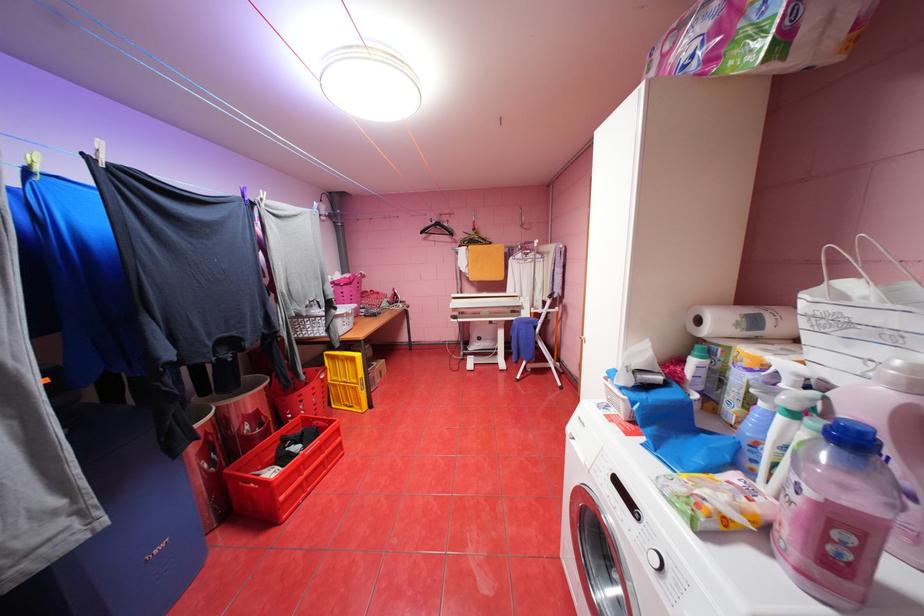
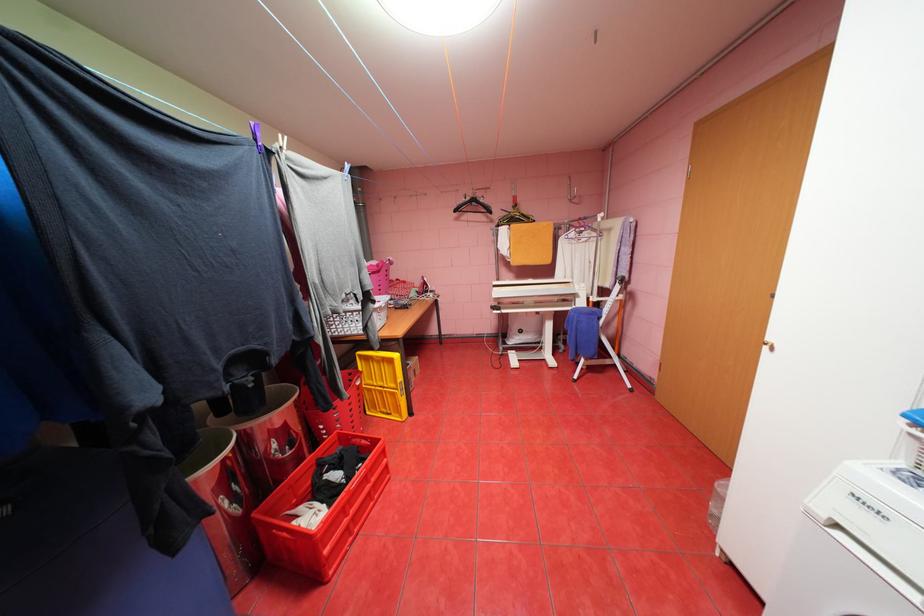
In a continuous first-person perspective shot, in which direction is the camera moving?

The cameraman walked toward left, forward.